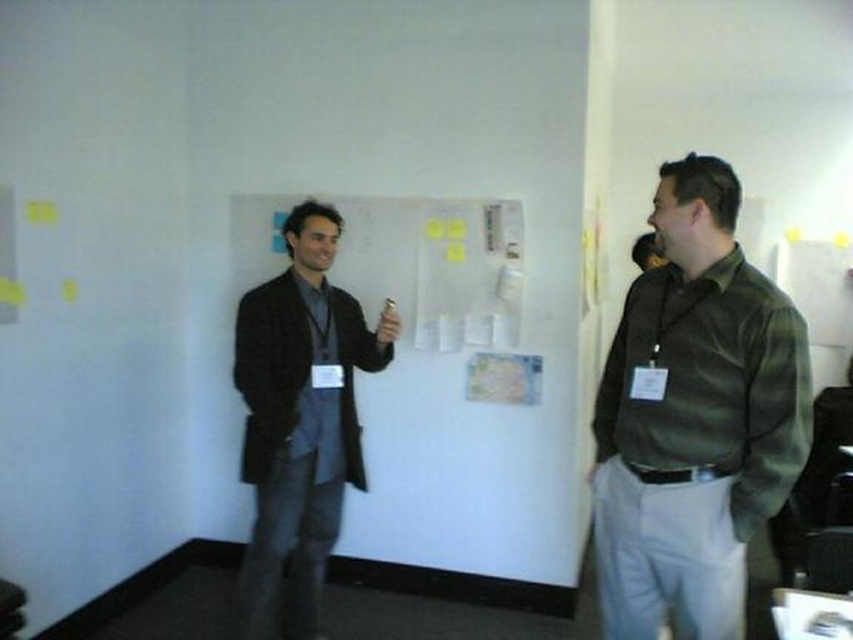
Does camouflage shirt at right appear on the left side of dark gray wool jacket at left?

In fact, camouflage shirt at right is to the right of dark gray wool jacket at left.

Is camouflage shirt at right to the right of dark gray wool jacket at left from the viewer's perspective?

Yes, camouflage shirt at right is to the right of dark gray wool jacket at left.

Between point (763, 410) and point (334, 452), which one is positioned in front?

Point (763, 410) is in front.

The width and height of the screenshot is (853, 640). I want to click on camouflage shirt at right, so click(694, 419).

Consider the image. Which is more to the left, white matte board at center or camouflage shirt at right?

white matte board at center is more to the left.

How far apart are white matte board at center and camouflage shirt at right?

white matte board at center is 1.24 meters away from camouflage shirt at right.

Is point (520, 454) positioned after point (664, 276)?

Yes, point (520, 454) is farther from viewer.

Locate an element on the screen. The image size is (853, 640). white matte board at center is located at coordinates (467, 401).

Is white matte board at center to the right of dark gray wool jacket at left from the viewer's perspective?

Indeed, white matte board at center is positioned on the right side of dark gray wool jacket at left.

Can you confirm if white matte board at center is positioned to the left of dark gray wool jacket at left?

In fact, white matte board at center is to the right of dark gray wool jacket at left.

Who is more distant from viewer, (386, 205) or (334, 456)?

Positioned behind is point (386, 205).

Image resolution: width=853 pixels, height=640 pixels. In order to click on white matte board at center in this screenshot , I will do `click(467, 401)`.